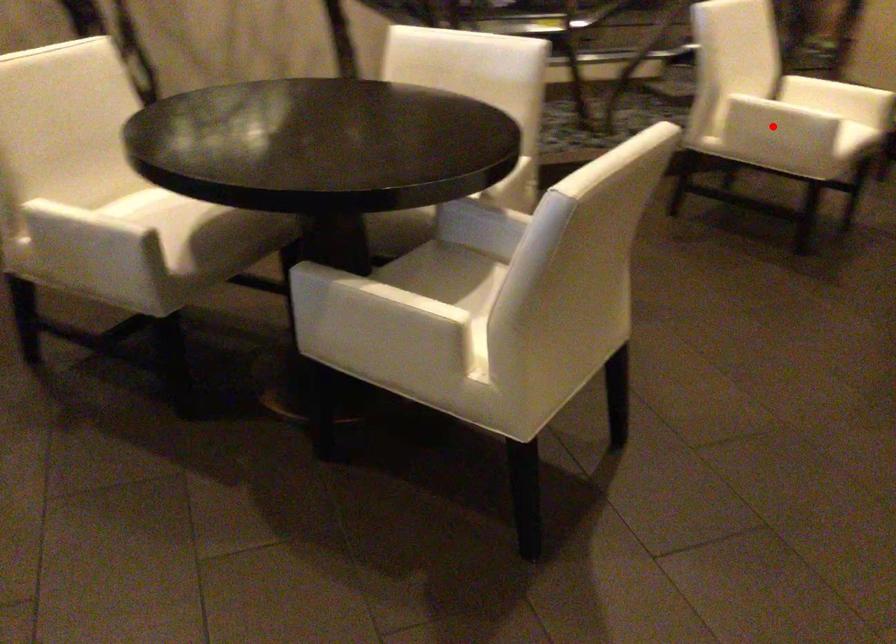
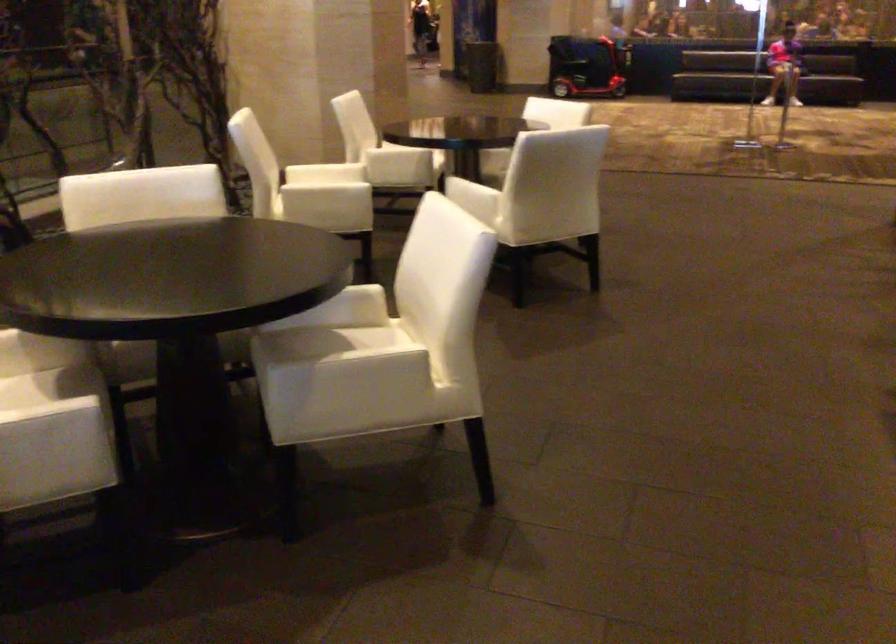
In the second image, find the point that corresponds to the highlighted location in the first image.

(325, 199)